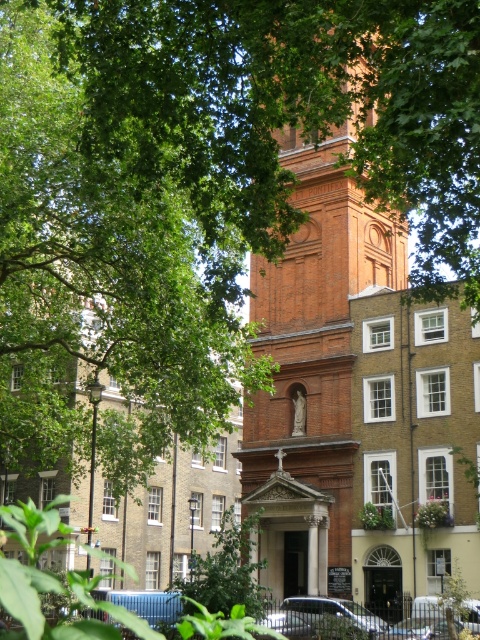
In the scene shown: Is silver metallic car at center above metallic silver car at lower right?

No.

Is silver metallic car at center positioned in front of metallic silver car at lower right?

No, it is not.

Is point (375, 625) closer to viewer compared to point (427, 616)?

Yes, it is.

Image resolution: width=480 pixels, height=640 pixels. Find the location of `silver metallic car at center`. silver metallic car at center is located at coordinates (324, 618).

Who is lower down, brick bell tower at center or metallic silver car at lower right?

Positioned lower is metallic silver car at lower right.

Which of these two, brick bell tower at center or metallic silver car at lower right, stands shorter?

metallic silver car at lower right

In order to click on brick bell tower at center in this screenshot , I will do `click(312, 301)`.

Where is `brick bell tower at center`? This screenshot has width=480, height=640. brick bell tower at center is located at coordinates (312, 301).

Between brick bell tower at center and silver metallic car at center, which one is positioned higher?

Positioned higher is brick bell tower at center.

Image resolution: width=480 pixels, height=640 pixels. What do you see at coordinates (312, 301) in the screenshot?
I see `brick bell tower at center` at bounding box center [312, 301].

In the scene shown: Who is more distant from viewer, [294,554] or [300,625]?

Positioned behind is point [294,554].

Where is `brick bell tower at center`? This screenshot has width=480, height=640. brick bell tower at center is located at coordinates (312, 301).